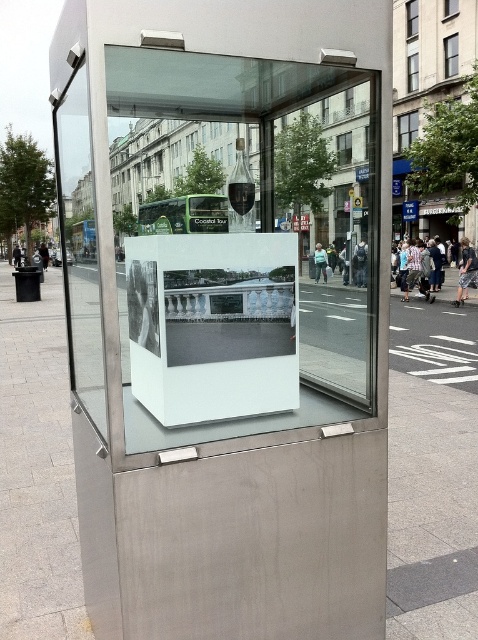
You are a delivery drone flying above the display case and need to land precisely on the brushed metal pavement at center. What coordinates should you target for your landing zone?

The 2D location of brushed metal pavement at center is at point (36, 472), so you should target coordinates 0.738 and 0.077 for your landing zone.

You are standing in front of the display case and want to walk towards the transparent glass door at left. Which direction should you move relative to the brushed metal pavement at center?

The transparent glass door at left is to the left of the brushed metal pavement at center. So, to reach the transparent glass door at left, you should move to the left side of the brushed metal pavement at center.

You are a delivery person holding a box that is 6 feet long. You need to place the box between the brushed metal pavement at center and the white glossy photo frame at center. Can the box fit in the space between them?

The distance between the brushed metal pavement at center and the white glossy photo frame at center is 5.54 feet. Since the box is 6 feet long, it cannot fit in the space between them as the available space is shorter than the box.